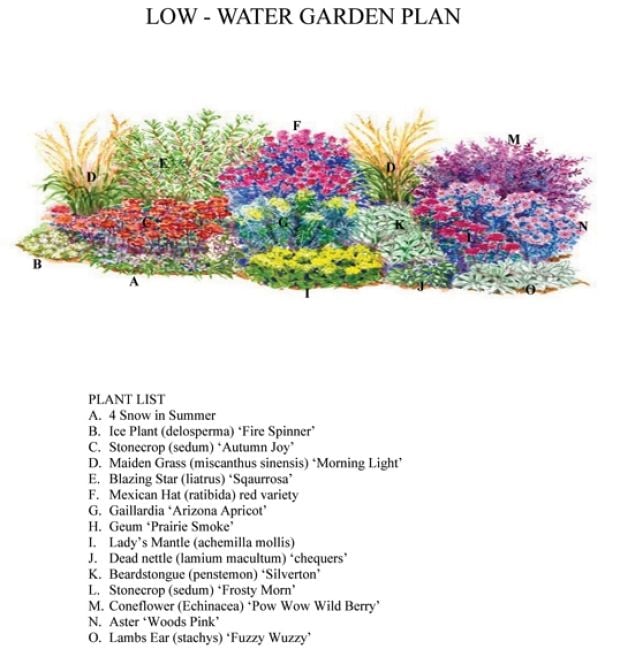
In order to click on plant in this screenshot , I will do `click(511, 199)`, `click(404, 160)`, `click(320, 165)`, `click(384, 228)`, `click(503, 272)`, `click(317, 267)`, `click(177, 228)`, `click(190, 175)`, `click(192, 265)`.